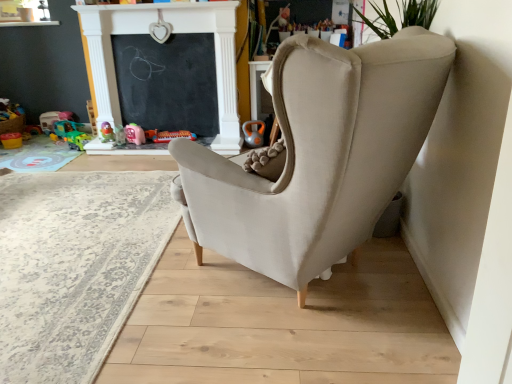
The height and width of the screenshot is (384, 512). What do you see at coordinates (11, 140) in the screenshot?
I see `matte yellow toy at left, the 1th toy when ordered from left to right` at bounding box center [11, 140].

You are a GUI agent. You are given a task and a screenshot of the screen. Output one action in this format:
    pyautogui.click(x=<x>, y=<y>)
    Task: Click on the matte plastic toy at center, marked as the 4th toy in a left-to-right arrangement
    This screenshot has height=384, width=512.
    Given the screenshot: What is the action you would take?
    pyautogui.click(x=106, y=132)

In order to face matte pink plastic toy at center, which ranks as the fifth toy in left-to-right order, should I rotate leftwards or rightwards?

Turn left by 15.838 degrees to look at matte pink plastic toy at center, which ranks as the fifth toy in left-to-right order.

In order to click on translucent plastic toy at lower left, the 6th toy when ordered from right to left in this screenshot , I will do `click(63, 128)`.

Measure the distance between plastic green toy car at center, which is the fifth toy in right-to-left order, and camera.

A distance of 12.33 feet exists between plastic green toy car at center, which is the fifth toy in right-to-left order, and camera.

Measure the distance between point [79,135] and camera.

The distance of point [79,135] from camera is 13.37 feet.

Find the location of a particular element. plastic/toy琴 at center, which appears as the sixth toy when viewed from the left is located at coordinates (173, 136).

Does beige fabric rug at lower left turn towards matte yellow toy at left, the 1th toy when ordered from left to right?

No.

Is beige fabric rug at lower left bigger than matte yellow toy at left, the 1th toy when ordered from left to right?

Yes.

Is beige fabric rug at lower left inside or outside of matte yellow toy at left, positioned as the 7th toy in right-to-left order?

beige fabric rug at lower left lies outside matte yellow toy at left, positioned as the 7th toy in right-to-left order.

Is point (105, 216) closer or farther from the camera than point (3, 138)?

Point (105, 216) is closer to the camera than point (3, 138).

From a real-world perspective, between plastic/toy琴 at center, which appears as the sixth toy when viewed from the left, and translucent plastic toy at lower left, the 6th toy when ordered from right to left, who is vertically lower?

translucent plastic toy at lower left, the 6th toy when ordered from right to left, from a real-world perspective.

Does point (178, 137) appear closer or farther from the camera than point (59, 127)?

Point (178, 137) is positioned closer to the camera compared to point (59, 127).

Is the position of plastic/toy琴 at center, placed as the second toy when sorted from right to left, less distant than that of translucent plastic toy at lower left, which ranks as the 2th toy in left-to-right order?

Yes, it is in front of translucent plastic toy at lower left, which ranks as the 2th toy in left-to-right order.

From the picture: Can translucent plastic toy at lower left, the 6th toy when ordered from right to left, be found inside plastic/toy琴 at center, which appears as the sixth toy when viewed from the left?

Actually, translucent plastic toy at lower left, the 6th toy when ordered from right to left, is outside plastic/toy琴 at center, which appears as the sixth toy when viewed from the left.

Consider the image. From a real-world perspective, does matte yellow toy at left, the 1th toy when ordered from left to right, sit lower than translucent plastic toy at lower left, which ranks as the 2th toy in left-to-right order?

Yes, from a real-world perspective, matte yellow toy at left, the 1th toy when ordered from left to right, is under translucent plastic toy at lower left, which ranks as the 2th toy in left-to-right order.

Relative to translucent plastic toy at lower left, the 6th toy when ordered from right to left, is matte yellow toy at left, the 1th toy when ordered from left to right, in front or behind?

Clearly, matte yellow toy at left, the 1th toy when ordered from left to right, is in front of translucent plastic toy at lower left, the 6th toy when ordered from right to left.

Is matte yellow toy at left, positioned as the 7th toy in right-to-left order, to the left or to the right of translucent plastic toy at lower left, the 6th toy when ordered from right to left, in the image?

Clearly, matte yellow toy at left, positioned as the 7th toy in right-to-left order, is on the left of translucent plastic toy at lower left, the 6th toy when ordered from right to left, in the image.

Are beige fabric rug at lower left and translucent plastic toy at lower left, the 6th toy when ordered from right to left, far apart?

beige fabric rug at lower left is far away from translucent plastic toy at lower left, the 6th toy when ordered from right to left.

Between beige fabric rug at lower left and translucent plastic toy at lower left, the 6th toy when ordered from right to left, which one has less height?

With less height is beige fabric rug at lower left.

Considering the sizes of objects beige fabric rug at lower left and translucent plastic toy at lower left, the 6th toy when ordered from right to left, in the image provided, who is thinner, beige fabric rug at lower left or translucent plastic toy at lower left, the 6th toy when ordered from right to left,?

With smaller width is translucent plastic toy at lower left, the 6th toy when ordered from right to left.

How many degrees apart are the facing directions of beige fabric rug at lower left and translucent plastic toy at lower left, the 6th toy when ordered from right to left?

137 degrees separate the facing orientations of beige fabric rug at lower left and translucent plastic toy at lower left, the 6th toy when ordered from right to left.

Which object is further away from the camera, matte plastic kettlebell at center, placed as the 1th toy when sorted from right to left, or plastic/toy琴 at center, which appears as the sixth toy when viewed from the left?

Positioned behind is plastic/toy琴 at center, which appears as the sixth toy when viewed from the left.

Is matte plastic kettlebell at center, arranged as the 7th toy when viewed from the left, oriented away from plastic/toy琴 at center, placed as the second toy when sorted from right to left?

No, matte plastic kettlebell at center, arranged as the 7th toy when viewed from the left, is not facing the opposite direction of plastic/toy琴 at center, placed as the second toy when sorted from right to left.

Does matte plastic kettlebell at center, placed as the 1th toy when sorted from right to left, have a greater height compared to plastic/toy琴 at center, which appears as the sixth toy when viewed from the left?

Yes, matte plastic kettlebell at center, placed as the 1th toy when sorted from right to left, is taller than plastic/toy琴 at center, which appears as the sixth toy when viewed from the left.

Would you say plastic/toy琴 at center, which appears as the sixth toy when viewed from the left, is part of matte plastic kettlebell at center, arranged as the 7th toy when viewed from the left,'s contents?

Actually, plastic/toy琴 at center, which appears as the sixth toy when viewed from the left, is outside matte plastic kettlebell at center, arranged as the 7th toy when viewed from the left.

Which object is closer to the camera taking this photo, translucent plastic toy at lower left, the 6th toy when ordered from right to left, or plastic/toy琴 at center, placed as the second toy when sorted from right to left?

Positioned in front is plastic/toy琴 at center, placed as the second toy when sorted from right to left.

From the image's perspective, which is above, translucent plastic toy at lower left, the 6th toy when ordered from right to left, or plastic/toy琴 at center, placed as the second toy when sorted from right to left?

From the image's view, translucent plastic toy at lower left, the 6th toy when ordered from right to left, is above.

Can you confirm if translucent plastic toy at lower left, the 6th toy when ordered from right to left, is smaller than plastic/toy琴 at center, placed as the second toy when sorted from right to left?

Actually, translucent plastic toy at lower left, the 6th toy when ordered from right to left, might be larger than plastic/toy琴 at center, placed as the second toy when sorted from right to left.

Is translucent plastic toy at lower left, the 6th toy when ordered from right to left, thinner than plastic/toy琴 at center, placed as the second toy when sorted from right to left?

In fact, translucent plastic toy at lower left, the 6th toy when ordered from right to left, might be wider than plastic/toy琴 at center, placed as the second toy when sorted from right to left.

Between matte plastic kettlebell at center, arranged as the 7th toy when viewed from the left, and translucent plastic toy at lower left, which ranks as the 2th toy in left-to-right order, which one appears on the left side from the viewer's perspective?

translucent plastic toy at lower left, which ranks as the 2th toy in left-to-right order, is more to the left.

From the image's perspective, count 2nd toys upward from the matte plastic kettlebell at center, arranged as the 7th toy when viewed from the left, and point to it. Please provide its 2D coordinates.

[(63, 128)]

Is matte plastic kettlebell at center, placed as the 1th toy when sorted from right to left, completely or partially outside of translucent plastic toy at lower left, the 6th toy when ordered from right to left?

That's correct, matte plastic kettlebell at center, placed as the 1th toy when sorted from right to left, is outside of translucent plastic toy at lower left, the 6th toy when ordered from right to left.

Looking at this image, are matte plastic kettlebell at center, placed as the 1th toy when sorted from right to left, and translucent plastic toy at lower left, the 6th toy when ordered from right to left, far apart?

Yes.

Image resolution: width=512 pixels, height=384 pixels. Identify the location of toy that is the 1st object above the beige fabric rug at lower left (from a real-world perspective). (11, 140).

You are a GUI agent. You are given a task and a screenshot of the screen. Output one action in this format:
    pyautogui.click(x=<x>, y=<y>)
    Task: Click on the 3rd toy behind the plastic/toy琴 at center, which appears as the sixth toy when viewed from the left
    Image resolution: width=512 pixels, height=384 pixels.
    Given the screenshot: What is the action you would take?
    pyautogui.click(x=63, y=128)

From the image, which object appears to be farther from plastic/toy琴 at center, which appears as the sixth toy when viewed from the left, matte plastic toy at center, marked as the 4th toy in a left-to-right arrangement, or matte pink plastic toy at center, the third toy in the right-to-left sequence?

Among the two, matte plastic toy at center, marked as the 4th toy in a left-to-right arrangement, is located further to plastic/toy琴 at center, which appears as the sixth toy when viewed from the left.

Which object lies further to the anchor point matte plastic kettlebell at center, arranged as the 7th toy when viewed from the left, translucent plastic toy at lower left, the 6th toy when ordered from right to left, or matte yellow toy at left, positioned as the 7th toy in right-to-left order?

matte yellow toy at left, positioned as the 7th toy in right-to-left order.

Considering their positions, is plastic green toy car at center, which is counted as the 3th toy, starting from the left, positioned further to translucent plastic toy at lower left, which ranks as the 2th toy in left-to-right order, than plastic/toy琴 at center, which appears as the sixth toy when viewed from the left?

The object further to translucent plastic toy at lower left, which ranks as the 2th toy in left-to-right order, is plastic/toy琴 at center, which appears as the sixth toy when viewed from the left.

Considering their positions, is matte plastic toy at center, marked as the 4th toy in a left-to-right arrangement, positioned further to plastic/toy琴 at center, placed as the second toy when sorted from right to left, than matte yellow toy at left, positioned as the 7th toy in right-to-left order?

Based on the image, matte yellow toy at left, positioned as the 7th toy in right-to-left order, appears to be further to plastic/toy琴 at center, placed as the second toy when sorted from right to left.

Considering their positions, is plastic/toy琴 at center, which appears as the sixth toy when viewed from the left, positioned further to plastic green toy car at center, which is counted as the 3th toy, starting from the left, than matte pink plastic toy at center, which ranks as the fifth toy in left-to-right order?

The object further to plastic green toy car at center, which is counted as the 3th toy, starting from the left, is plastic/toy琴 at center, which appears as the sixth toy when viewed from the left.

Looking at the image, which one is located closer to black chalkboard at upper center, matte plastic toy at center, which appears as the 4th toy when viewed from the right, or plastic/toy琴 at center, placed as the second toy when sorted from right to left?

The object closer to black chalkboard at upper center is plastic/toy琴 at center, placed as the second toy when sorted from right to left.

Based on their spatial positions, is plastic green toy car at center, which is counted as the 3th toy, starting from the left, or black chalkboard at upper center further from translucent plastic toy at lower left, the 6th toy when ordered from right to left?

black chalkboard at upper center.

Looking at the image, which one is located closer to plastic/toy琴 at center, which appears as the sixth toy when viewed from the left, plastic green toy car at center, which is counted as the 3th toy, starting from the left, or translucent plastic toy at lower left, which ranks as the 2th toy in left-to-right order?

Among the two, plastic green toy car at center, which is counted as the 3th toy, starting from the left, is located nearer to plastic/toy琴 at center, which appears as the sixth toy when viewed from the left.

Find the location of a particular element. bulletin board between matte yellow toy at left, the 1th toy when ordered from left to right, and plastic/toy琴 at center, which appears as the sixth toy when viewed from the left, in the horizontal direction is located at coordinates (167, 82).

Where is `toy located between matte yellow toy at left, the 1th toy when ordered from left to right, and plastic green toy car at center, which is counted as the 3th toy, starting from the left, in the left-right direction`? The height and width of the screenshot is (384, 512). toy located between matte yellow toy at left, the 1th toy when ordered from left to right, and plastic green toy car at center, which is counted as the 3th toy, starting from the left, in the left-right direction is located at coordinates (63, 128).

Locate an element on the screen. Image resolution: width=512 pixels, height=384 pixels. bulletin board between beige fabric rug at lower left and plastic/toy琴 at center, placed as the second toy when sorted from right to left, along the z-axis is located at coordinates (x=167, y=82).

I want to click on bulletin board between beige fabric rug at lower left and matte plastic kettlebell at center, placed as the 1th toy when sorted from right to left, along the z-axis, so click(167, 82).